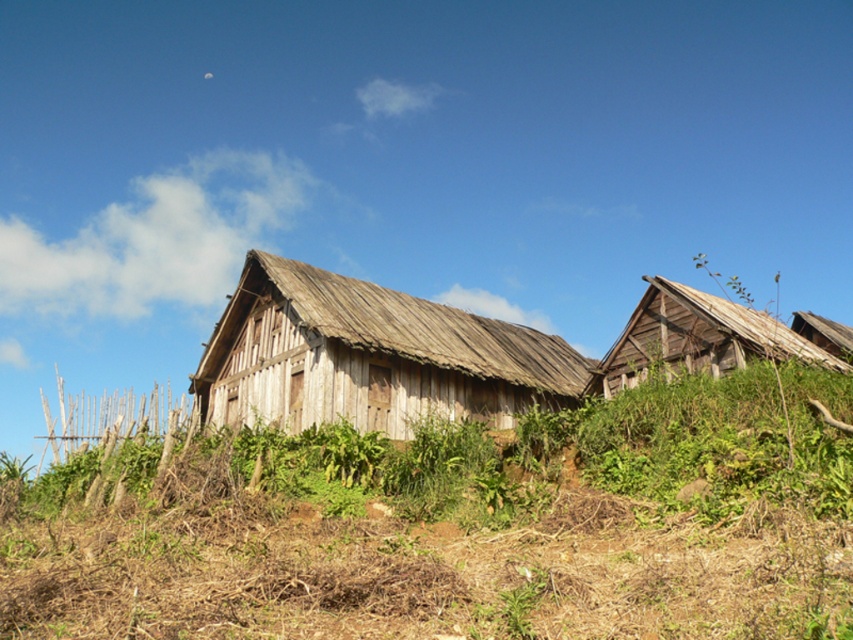
Between weathered wood hut at right and weathered wood hut at upper right, which one appears on the left side from the viewer's perspective?

weathered wood hut at right is more to the left.

Is weathered wood hut at right closer to the viewer compared to weathered wood hut at upper right?

Yes, it is.

Does point (614, 385) lie behind point (792, 323)?

No, it is in front of (792, 323).

Locate an element on the screen. This screenshot has height=640, width=853. weathered wood hut at right is located at coordinates (697, 339).

Does weathered wood hut at center lie in front of weathered wood hut at right?

No, weathered wood hut at center is behind weathered wood hut at right.

The height and width of the screenshot is (640, 853). Identify the location of weathered wood hut at center. click(370, 355).

Where is `weathered wood hut at center`? The height and width of the screenshot is (640, 853). weathered wood hut at center is located at coordinates (370, 355).

Image resolution: width=853 pixels, height=640 pixels. Find the location of `weathered wood hut at center`. weathered wood hut at center is located at coordinates (370, 355).

Between point (352, 353) and point (849, 362), which one is positioned behind?

The point (849, 362) is more distant.

Between weathered wood hut at center and weathered wood hut at upper right, which one has more height?

With more height is weathered wood hut at center.

Between point (357, 339) and point (844, 344), which one is positioned in front?

Positioned in front is point (357, 339).

Locate an element on the screen. weathered wood hut at center is located at coordinates (370, 355).